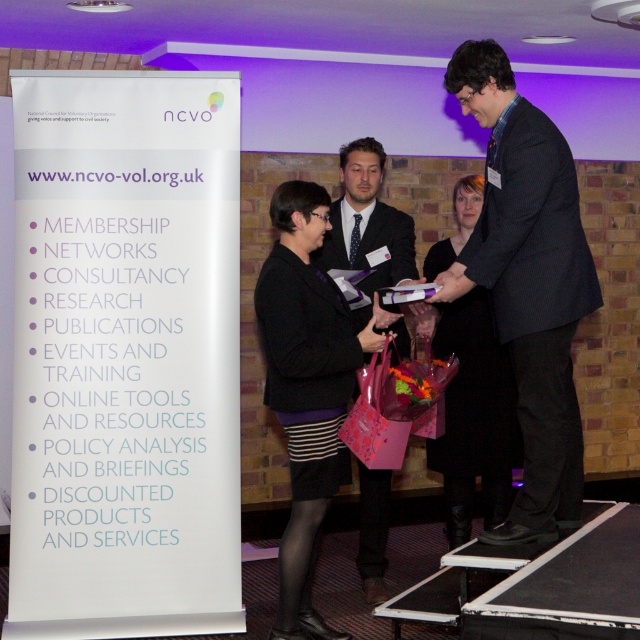
Between black fabric dress at center and matte black suit at center, which one appears on the right side from the viewer's perspective?

Positioned to the right is black fabric dress at center.

Is point (492, 387) in front of point (362, 288)?

No, (492, 387) is further to viewer.

Which is in front, point (456, 532) or point (378, 193)?

Positioned in front is point (456, 532).

Locate an element on the screen. The width and height of the screenshot is (640, 640). black fabric dress at center is located at coordinates 474,417.

Does black textured suit at center have a lesser height compared to black fabric dress at center?

In fact, black textured suit at center may be taller than black fabric dress at center.

Which is behind, point (520, 504) or point (449, 388)?

Point (449, 388)

Who is more distant from viewer, (525, 516) or (456, 522)?

The point (456, 522) is behind.

The image size is (640, 640). I want to click on black textured suit at center, so click(x=528, y=282).

Can you confirm if black textured skirt at center is bigger than matte black suit at center?

Yes, black textured skirt at center is bigger than matte black suit at center.

Between black textured skirt at center and matte black suit at center, which one appears on the left side from the viewer's perspective?

From the viewer's perspective, black textured skirt at center appears more on the left side.

Where is `black textured skirt at center`? The width and height of the screenshot is (640, 640). black textured skirt at center is located at coordinates (307, 387).